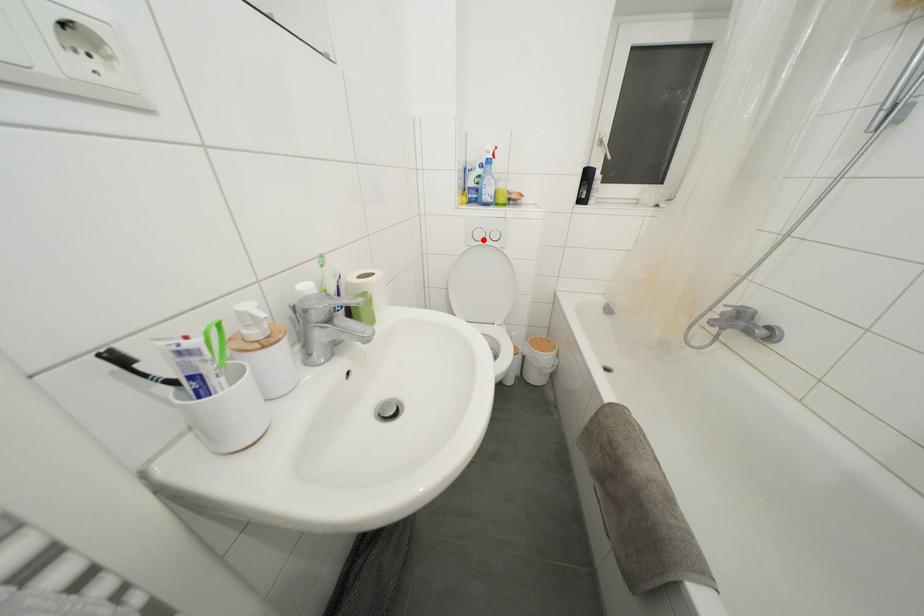
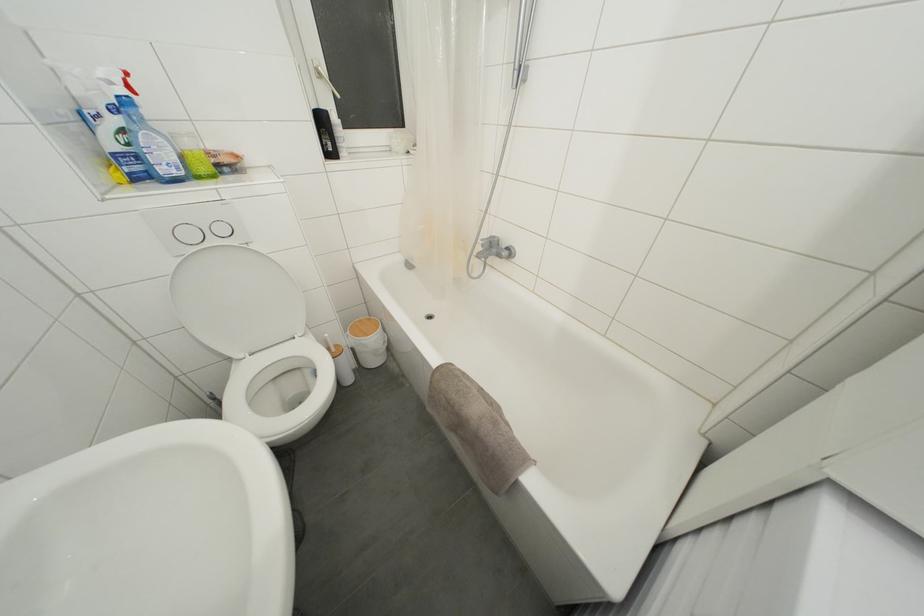
Locate, in the second image, the point that corresponds to the highlighted location in the first image.

(195, 240)